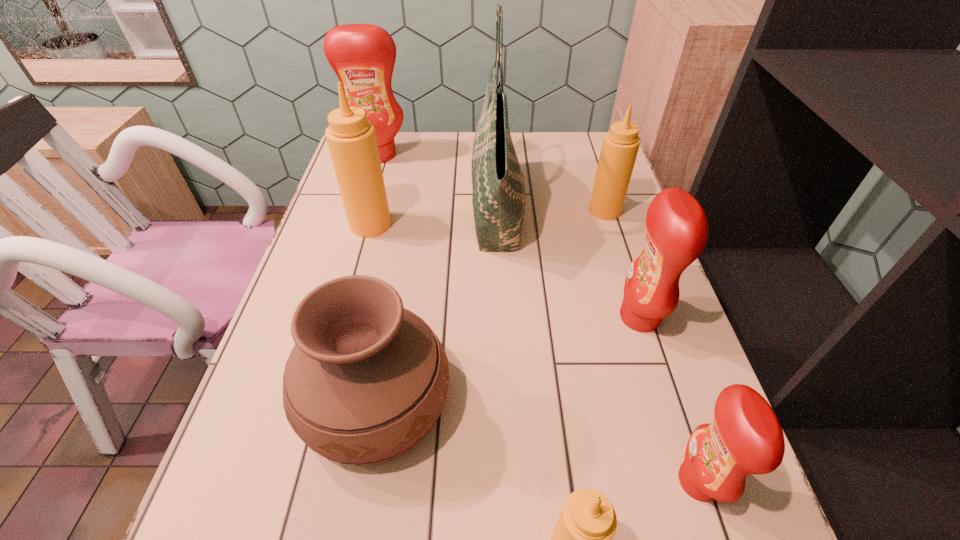
Identify the location of free spot between the rightmost tan condiment and the tote bag. (550, 210).

Locate an element on the screen. The image size is (960, 540). vacant space that's between the rightmost tan condiment and the smallest red condiment is located at coordinates (652, 346).

Find the location of `free space between the leftmost tan condiment and the nearest red condiment`. free space between the leftmost tan condiment and the nearest red condiment is located at coordinates (535, 353).

I want to click on vacant space that's between the biggest tan condiment and the second farthest red condiment, so click(505, 271).

In order to click on free area in between the smallest red condiment and the biggest red condiment in this screenshot , I will do `click(539, 318)`.

Where is `the closest object to the tallest object`? This screenshot has height=540, width=960. the closest object to the tallest object is located at coordinates (620, 146).

Identify which object is the seventh nearest to the leftmost tan condiment. Please provide its 2D coordinates. Your answer should be formatted as a tuple, i.e. [(x, y)], where the tuple contains the x and y coordinates of a point satisfying the conditions above.

[(745, 437)]

Where is `condiment that is the fourth nearest to the second biggest tan condiment`? Image resolution: width=960 pixels, height=540 pixels. condiment that is the fourth nearest to the second biggest tan condiment is located at coordinates coord(745,437).

Identify which condiment is the third closest to the smallest tan condiment. Please provide its 2D coordinates. Your answer should be formatted as a tuple, i.e. [(x, y)], where the tuple contains the x and y coordinates of a point satisfying the conditions above.

[(351, 139)]

This screenshot has height=540, width=960. Identify the location of the second closest red condiment to the leftmost tan condiment. (677, 231).